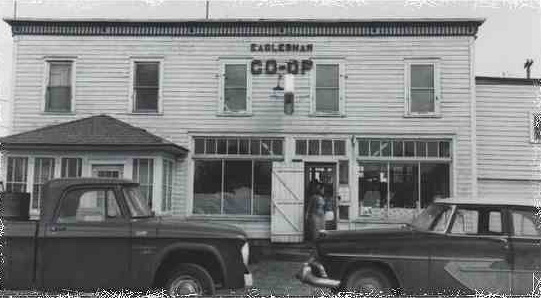
Identify the location of window. The image size is (541, 298). (467, 224).